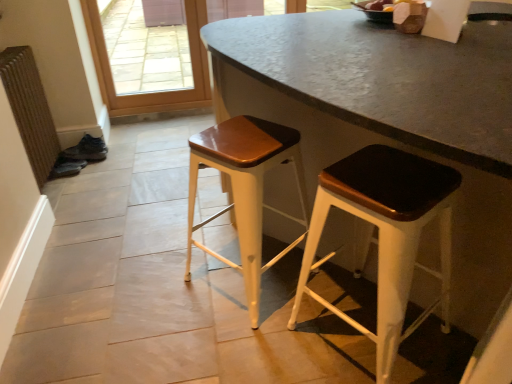
What do you see at coordinates (386, 235) in the screenshot? I see `matte black stool at center, which is counted as the first stool, starting from the right` at bounding box center [386, 235].

Find the location of a particular element. The image size is (512, 384). matte black stool at center, the 2th stool positioned from the left is located at coordinates (386, 235).

Find the location of a particular element. The height and width of the screenshot is (384, 512). wooden seat stool at center, acting as the 2th stool starting from the right is located at coordinates (245, 189).

What do you see at coordinates (245, 189) in the screenshot? The image size is (512, 384). I see `wooden seat stool at center, the 1th stool when ordered from left to right` at bounding box center [245, 189].

Image resolution: width=512 pixels, height=384 pixels. I want to click on matte black stool at center, the 2th stool positioned from the left, so click(x=386, y=235).

Is brown textured radiator at left bigger or smaller than matte black stool at center, which is counted as the first stool, starting from the right?

brown textured radiator at left is smaller than matte black stool at center, which is counted as the first stool, starting from the right.

Is brown textured radiator at left turned away from matte black stool at center, which is counted as the first stool, starting from the right?

No, matte black stool at center, which is counted as the first stool, starting from the right, is not at the back of brown textured radiator at left.

From the image's perspective, is brown textured radiator at left on top of matte black stool at center, the 2th stool positioned from the left?

Yes, from the image's perspective, brown textured radiator at left is over matte black stool at center, the 2th stool positioned from the left.

Does brown textured radiator at left come behind matte black stool at center, which is counted as the first stool, starting from the right?

Yes, it is behind matte black stool at center, which is counted as the first stool, starting from the right.

From a real-world perspective, is brown textured radiator at left positioned above or below wooden seat stool at center, the 1th stool when ordered from left to right?

brown textured radiator at left is situated higher than wooden seat stool at center, the 1th stool when ordered from left to right, in the real world.

Is brown textured radiator at left wider or thinner than wooden seat stool at center, the 1th stool when ordered from left to right?

In the image, brown textured radiator at left appears to be more narrow than wooden seat stool at center, the 1th stool when ordered from left to right.

Which of these two, brown textured radiator at left or wooden seat stool at center, acting as the 2th stool starting from the right, is bigger?

Bigger between the two is wooden seat stool at center, acting as the 2th stool starting from the right.

Considering the positions of point (28, 51) and point (233, 120), is point (28, 51) closer or farther from the camera than point (233, 120)?

Point (28, 51) is farther from the camera than point (233, 120).

Is wooden seat stool at center, the 1th stool when ordered from left to right, at the left side of brown textured radiator at left?

In fact, wooden seat stool at center, the 1th stool when ordered from left to right, is to the right of brown textured radiator at left.

Is wooden seat stool at center, the 1th stool when ordered from left to right, not close to brown textured radiator at left?

Yes, wooden seat stool at center, the 1th stool when ordered from left to right, is far from brown textured radiator at left.

Which is closer to the camera, (220, 258) or (22, 48)?

The point (220, 258) is closer.

Between point (423, 200) and point (37, 172), which one is positioned in front?

The point (423, 200) is in front.

Is matte black stool at center, which is counted as the first stool, starting from the right, beside brown textured radiator at left?

matte black stool at center, which is counted as the first stool, starting from the right, and brown textured radiator at left are clearly separated.

Who is shorter, matte black stool at center, the 2th stool positioned from the left, or brown textured radiator at left?

Standing shorter between the two is matte black stool at center, the 2th stool positioned from the left.

Considering their positions, is matte black stool at center, the 2th stool positioned from the left, located in front of or behind brown textured radiator at left?

matte black stool at center, the 2th stool positioned from the left, is in front of brown textured radiator at left.

How much distance is there between wooden seat stool at center, acting as the 2th stool starting from the right, and matte black stool at center, which is counted as the first stool, starting from the right?

wooden seat stool at center, acting as the 2th stool starting from the right, is 13.94 inches away from matte black stool at center, which is counted as the first stool, starting from the right.

Can you see wooden seat stool at center, acting as the 2th stool starting from the right, touching matte black stool at center, which is counted as the first stool, starting from the right?

No.

Between wooden seat stool at center, the 1th stool when ordered from left to right, and matte black stool at center, the 2th stool positioned from the left, which one has smaller width?

Thinner between the two is matte black stool at center, the 2th stool positioned from the left.

Is point (252, 139) positioned behind point (398, 213)?

Yes, it is behind point (398, 213).

The width and height of the screenshot is (512, 384). What are the coordinates of `stool above the wooden seat stool at center, the 1th stool when ordered from left to right (from a real-world perspective)` in the screenshot? It's located at 386,235.

Is matte black stool at center, which is counted as the first stool, starting from the right, spatially inside wooden seat stool at center, acting as the 2th stool starting from the right, or outside of it?

matte black stool at center, which is counted as the first stool, starting from the right, lies outside wooden seat stool at center, acting as the 2th stool starting from the right.

Which is less distant, [384,261] or [188,211]?

The point [384,261] is closer.

From a real-world perspective, does matte black stool at center, the 2th stool positioned from the left, sit lower than wooden seat stool at center, acting as the 2th stool starting from the right?

No, from a real-world perspective, matte black stool at center, the 2th stool positioned from the left, is not under wooden seat stool at center, acting as the 2th stool starting from the right.

Where is `the 1st stool below the brown textured radiator at left (from a real-world perspective)`? The height and width of the screenshot is (384, 512). the 1st stool below the brown textured radiator at left (from a real-world perspective) is located at coordinates (386, 235).

You are a GUI agent. You are given a task and a screenshot of the screen. Output one action in this format:
    pyautogui.click(x=<x>, y=<y>)
    Task: Click on the radiator above the wooden seat stool at center, acting as the 2th stool starting from the right (from a real-world perspective)
    The image size is (512, 384).
    Given the screenshot: What is the action you would take?
    pyautogui.click(x=30, y=109)

Looking at the image, which one is located further to brown textured radiator at left, matte black stool at center, the 2th stool positioned from the left, or wooden seat stool at center, acting as the 2th stool starting from the right?

Based on the image, matte black stool at center, the 2th stool positioned from the left, appears to be further to brown textured radiator at left.

Estimate the real-world distances between objects in this image. Which object is further from matte black stool at center, which is counted as the first stool, starting from the right, wooden seat stool at center, acting as the 2th stool starting from the right, or brown textured radiator at left?

Based on the image, brown textured radiator at left appears to be further to matte black stool at center, which is counted as the first stool, starting from the right.

Which object lies further to the anchor point matte black stool at center, which is counted as the first stool, starting from the right, brown textured radiator at left or wooden seat stool at center, the 1th stool when ordered from left to right?

Among the two, brown textured radiator at left is located further to matte black stool at center, which is counted as the first stool, starting from the right.

Based on their spatial positions, is matte black stool at center, the 2th stool positioned from the left, or brown textured radiator at left further from wooden seat stool at center, acting as the 2th stool starting from the right?

brown textured radiator at left is positioned further to the anchor wooden seat stool at center, acting as the 2th stool starting from the right.

From the image, which object appears to be farther from brown textured radiator at left, wooden seat stool at center, the 1th stool when ordered from left to right, or matte black stool at center, which is counted as the first stool, starting from the right?

matte black stool at center, which is counted as the first stool, starting from the right, is positioned further to the anchor brown textured radiator at left.

When comparing their distances from wooden seat stool at center, the 1th stool when ordered from left to right, does brown textured radiator at left or matte black stool at center, which is counted as the first stool, starting from the right, seem closer?

matte black stool at center, which is counted as the first stool, starting from the right, is positioned closer to the anchor wooden seat stool at center, the 1th stool when ordered from left to right.

At what (x,y) coordinates should I click in order to perform the action: click on stool between brown textured radiator at left and matte black stool at center, the 2th stool positioned from the left, from left to right. Please return your answer as a coordinate pair (x, y). Image resolution: width=512 pixels, height=384 pixels. Looking at the image, I should click on (245, 189).